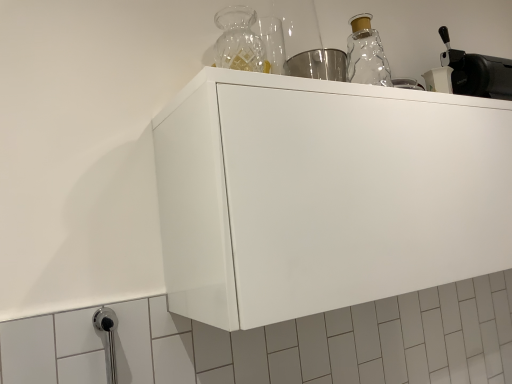
What do you see at coordinates (477, 72) in the screenshot?
I see `black matte coffee machine at upper right` at bounding box center [477, 72].

At what (x,y) coordinates should I click in order to perform the action: click on black matte coffee machine at upper right. Please return your answer as a coordinate pair (x, y). Looking at the image, I should click on (477, 72).

This screenshot has width=512, height=384. What do you see at coordinates (325, 194) in the screenshot? I see `white matte cabinet at center` at bounding box center [325, 194].

In order to click on white matte cabinet at center in this screenshot , I will do 325,194.

The image size is (512, 384). I want to click on black matte coffee machine at upper right, so click(x=477, y=72).

Considering the positions of objects white matte cabinet at center and black matte coffee machine at upper right in the image provided, who is more to the right, white matte cabinet at center or black matte coffee machine at upper right?

From the viewer's perspective, black matte coffee machine at upper right appears more on the right side.

Between white matte cabinet at center and black matte coffee machine at upper right, which one is positioned in front?

white matte cabinet at center.

Considering the positions of point (457, 277) and point (501, 81), is point (457, 277) closer or farther from the camera than point (501, 81)?

Point (457, 277).

From the image's perspective, between white matte cabinet at center and black matte coffee machine at upper right, who is located below?

white matte cabinet at center, from the image's perspective.

From a real-world perspective, is white matte cabinet at center positioned under black matte coffee machine at upper right based on gravity?

Yes.

Looking at their sizes, would you say white matte cabinet at center is wider or thinner than black matte coffee machine at upper right?

Considering their sizes, white matte cabinet at center looks broader than black matte coffee machine at upper right.

Is white matte cabinet at center shorter than black matte coffee machine at upper right?

No.

Between white matte cabinet at center and black matte coffee machine at upper right, which one has larger size?

white matte cabinet at center.

Is black matte coffee machine at upper right completely or partially inside white matte cabinet at center?

Actually, black matte coffee machine at upper right is outside white matte cabinet at center.

Is white matte cabinet at center with black matte coffee machine at upper right?

No, white matte cabinet at center is not beside black matte coffee machine at upper right.

Is black matte coffee machine at upper right at the back of white matte cabinet at center?

No, white matte cabinet at center is not facing away from black matte coffee machine at upper right.

How different are the orientations of white matte cabinet at center and black matte coffee machine at upper right in degrees?

The angular difference between white matte cabinet at center and black matte coffee machine at upper right is 0.299 degrees.

In order to click on cabinetry located below the black matte coffee machine at upper right (from the image's perspective) in this screenshot , I will do `click(325, 194)`.

Would you say black matte coffee machine at upper right is to the left or to the right of white matte cabinet at center in the picture?

From the image, it's evident that black matte coffee machine at upper right is to the right of white matte cabinet at center.

Between black matte coffee machine at upper right and white matte cabinet at center, which one is positioned in front?

white matte cabinet at center is closer to the camera.

Considering the positions of point (440, 29) and point (331, 148), is point (440, 29) closer or farther from the camera than point (331, 148)?

Clearly, point (440, 29) is more distant from the camera than point (331, 148).

From the image's perspective, is black matte coffee machine at upper right under white matte cabinet at center?

No, from the image's perspective, black matte coffee machine at upper right is not below white matte cabinet at center.

From a real-world perspective, is black matte coffee machine at upper right positioned above or below white matte cabinet at center?

From a real-world perspective, black matte coffee machine at upper right is physically above white matte cabinet at center.

Looking at their sizes, would you say black matte coffee machine at upper right is wider or thinner than white matte cabinet at center?

Clearly, black matte coffee machine at upper right has less width compared to white matte cabinet at center.

Considering the sizes of black matte coffee machine at upper right and white matte cabinet at center in the image, is black matte coffee machine at upper right taller or shorter than white matte cabinet at center?

Clearly, black matte coffee machine at upper right is shorter compared to white matte cabinet at center.

Considering the sizes of objects black matte coffee machine at upper right and white matte cabinet at center in the image provided, who is smaller, black matte coffee machine at upper right or white matte cabinet at center?

black matte coffee machine at upper right.

Is black matte coffee machine at upper right located outside white matte cabinet at center?

Yes, black matte coffee machine at upper right is outside of white matte cabinet at center.

Is black matte coffee machine at upper right in contact with white matte cabinet at center?

black matte coffee machine at upper right and white matte cabinet at center are clearly separated.

Is black matte coffee machine at upper right facing away from white matte cabinet at center?

No, black matte coffee machine at upper right is not facing away from white matte cabinet at center.

Where is `appliance located on the right of white matte cabinet at center`? This screenshot has height=384, width=512. appliance located on the right of white matte cabinet at center is located at coordinates (477, 72).

Locate an element on the screen. appliance above the white matte cabinet at center (from a real-world perspective) is located at coordinates (477, 72).

I want to click on appliance above the white matte cabinet at center (from the image's perspective), so click(477, 72).